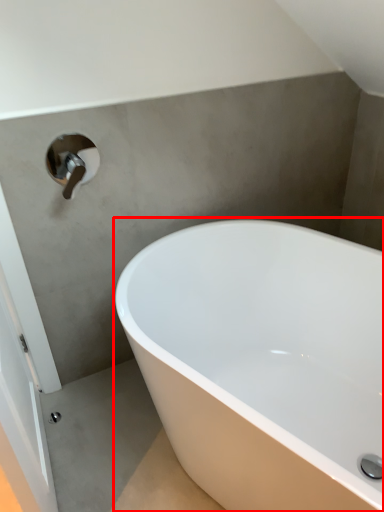
Question: Considering the relative positions of bathtub (annotated by the red box) and tap in the image provided, where is bathtub (annotated by the red box) located with respect to the staircase?

Choices:
 (A) left
 (B) right

Answer: (B)